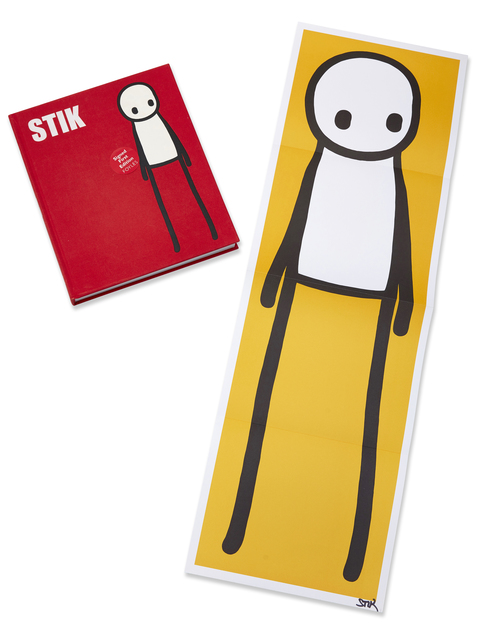
Locate an element on the screen. The width and height of the screenshot is (490, 640). sticker is located at coordinates (125, 163).